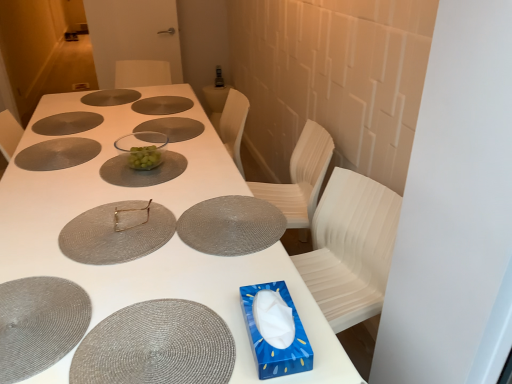
Where is `free space between matte gray placemat at center, the 8th glass plate positioned from the back, and transparent glass bowl at center, the fourth glass plate viewed from the back`? The height and width of the screenshot is (384, 512). free space between matte gray placemat at center, the 8th glass plate positioned from the back, and transparent glass bowl at center, the fourth glass plate viewed from the back is located at coordinates (138, 172).